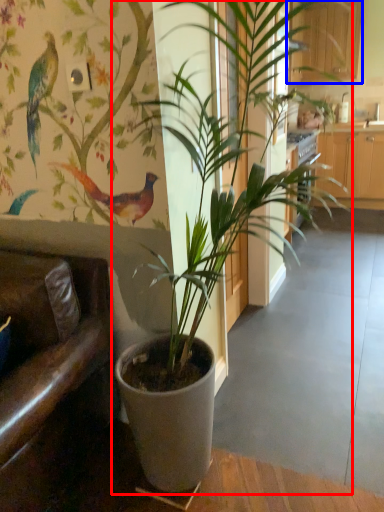
Question: Which object is further to the camera taking this photo, houseplant (highlighted by a red box) or furniture (highlighted by a blue box)?

Choices:
 (A) houseplant
 (B) furniture

Answer: (B)